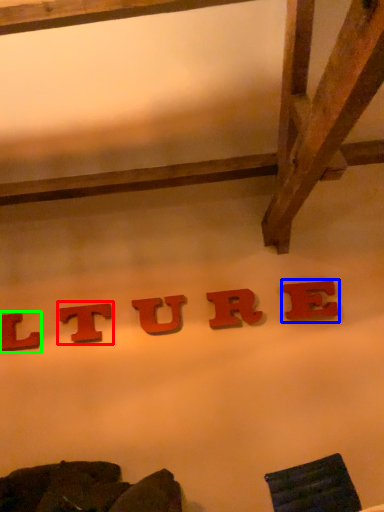
Question: Which is nearer to the letter (highlighted by a red box)? letter (highlighted by a blue box) or letter (highlighted by a green box).

Choices:
 (A) letter
 (B) letter

Answer: (B)